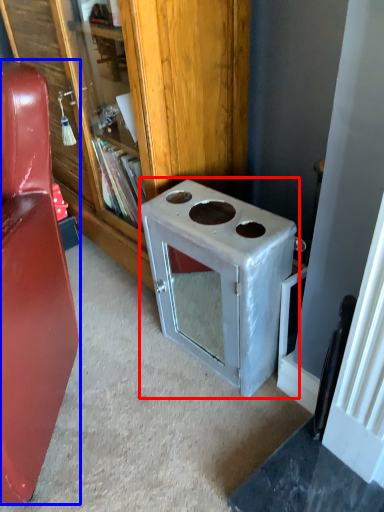
Question: Which point is further to the camera, appliance (highlighted by a red box) or furniture (highlighted by a blue box)?

Choices:
 (A) appliance
 (B) furniture

Answer: (A)